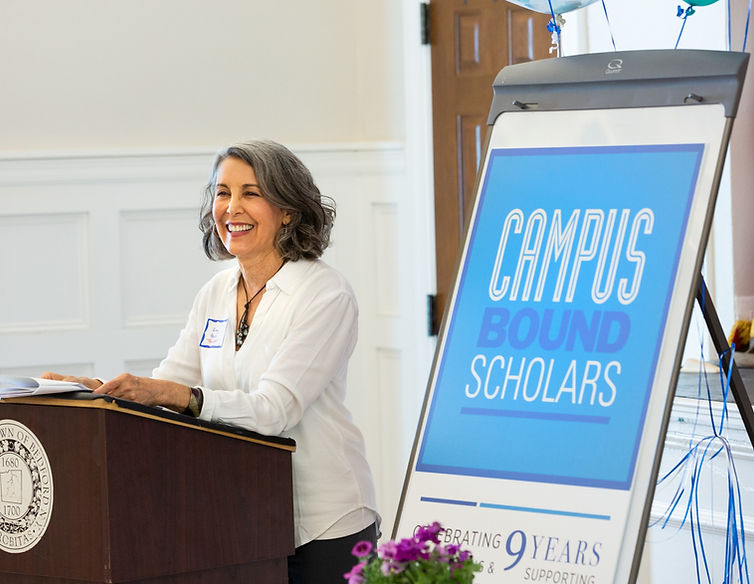
Where is `door`? This screenshot has width=754, height=584. door is located at coordinates (458, 95).